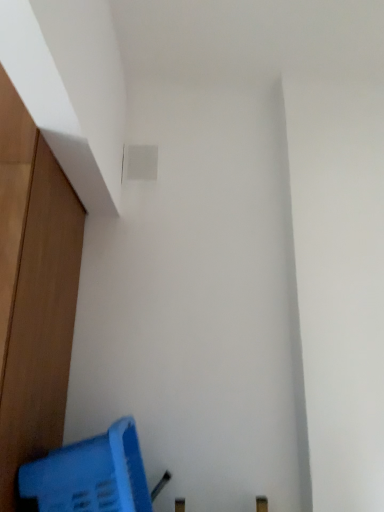
The height and width of the screenshot is (512, 384). Describe the element at coordinates (90, 475) in the screenshot. I see `blue plastic crate at lower left` at that location.

What are the coordinates of `blue plastic crate at lower left` in the screenshot? It's located at (90, 475).

Where is `blue plastic crate at lower left`? The image size is (384, 512). blue plastic crate at lower left is located at coordinates [90, 475].